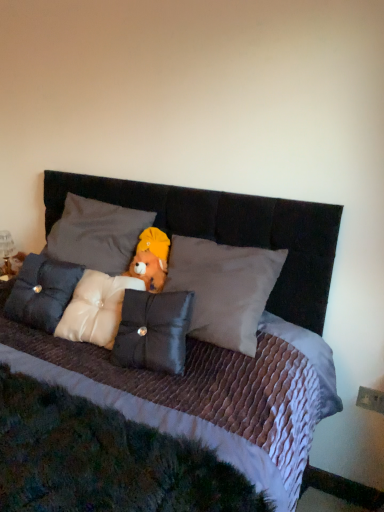
Question: Would you say fuzzy fabric teddy bear at center is inside or outside white satin pillow at center, placed as the second pillow when sorted from left to right?

Choices:
 (A) outside
 (B) inside

Answer: (A)

Question: Is point (150, 253) closer or farther from the camera than point (69, 199)?

Choices:
 (A) closer
 (B) farther

Answer: (A)

Question: Based on their relative distances, which object is farther from the metallic gold figurine at left?

Choices:
 (A) satin black pillow at center, which ranks as the first pillow in right-to-left order
 (B) satin white pillow at center, which is the second pillow in right-to-left order
 (C) satin cushion at center, which ranks as the 4th pillow in right-to-left order
 (D) white satin pillow at center, placed as the second pillow when sorted from left to right
 (E) fuzzy fabric teddy bear at center

Answer: (A)

Question: Which object is positioned farthest from the satin black pillow at center, arranged as the 4th pillow when viewed from the left?

Choices:
 (A) white satin pillow at center, placed as the second pillow when sorted from left to right
 (B) satin white pillow at center, which ranks as the third pillow in left-to-right order
 (C) metallic gold figurine at left
 (D) satin cushion at center, which ranks as the 4th pillow in right-to-left order
 (E) fuzzy fabric teddy bear at center

Answer: (C)